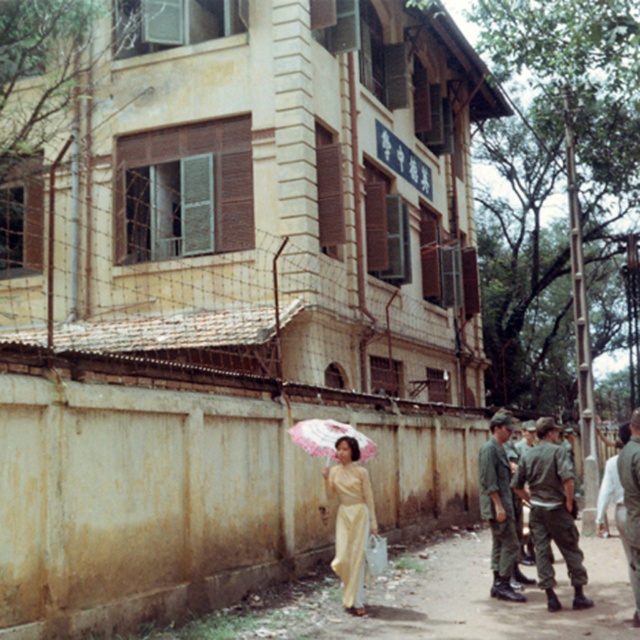
Question: Does camouflage fabric uniform at center have a lesser width compared to light yellow silk ao dai at center?

Choices:
 (A) yes
 (B) no

Answer: (B)

Question: Is light yellow silk ao dai at center to the left of pink fabric umbrella at center from the viewer's perspective?

Choices:
 (A) yes
 (B) no

Answer: (B)

Question: Which point is farther to the camera?

Choices:
 (A) pos(628,536)
 (B) pos(339,497)
 (C) pos(323,428)
 (D) pos(502,428)

Answer: (D)

Question: Which object is the closest to the camouflage fabric uniform at right?

Choices:
 (A) light yellow silk ao dai at center
 (B) camouflage fabric uniform at center
 (C) pink fabric umbrella at center

Answer: (B)

Question: Can you confirm if light yellow silk ao dai at center is positioned to the right of pink fabric umbrella at center?

Choices:
 (A) yes
 (B) no

Answer: (A)

Question: Considering the real-world distances, which object is closest to the green military uniform at center?

Choices:
 (A) camouflage fabric uniform at center
 (B) light yellow silk ao dai at center

Answer: (A)